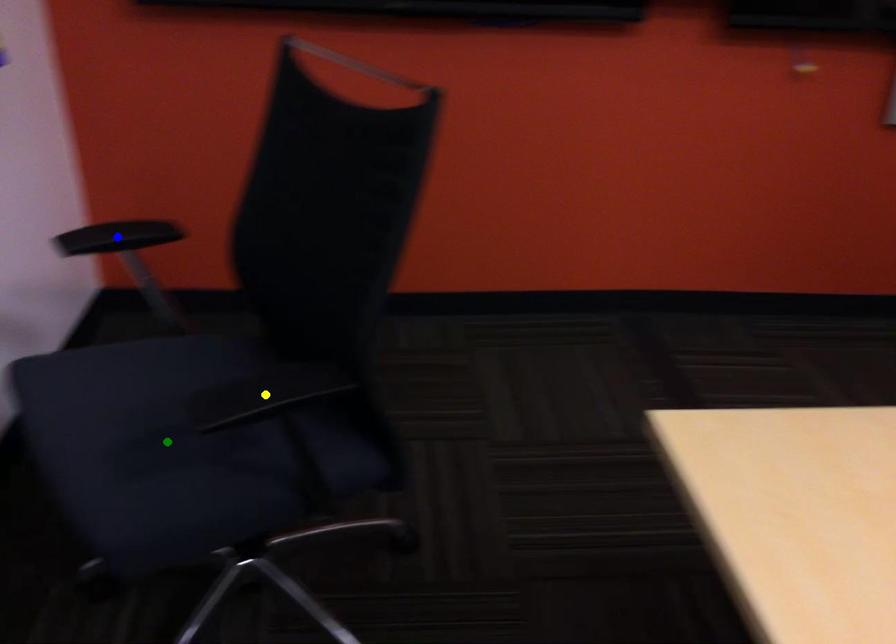
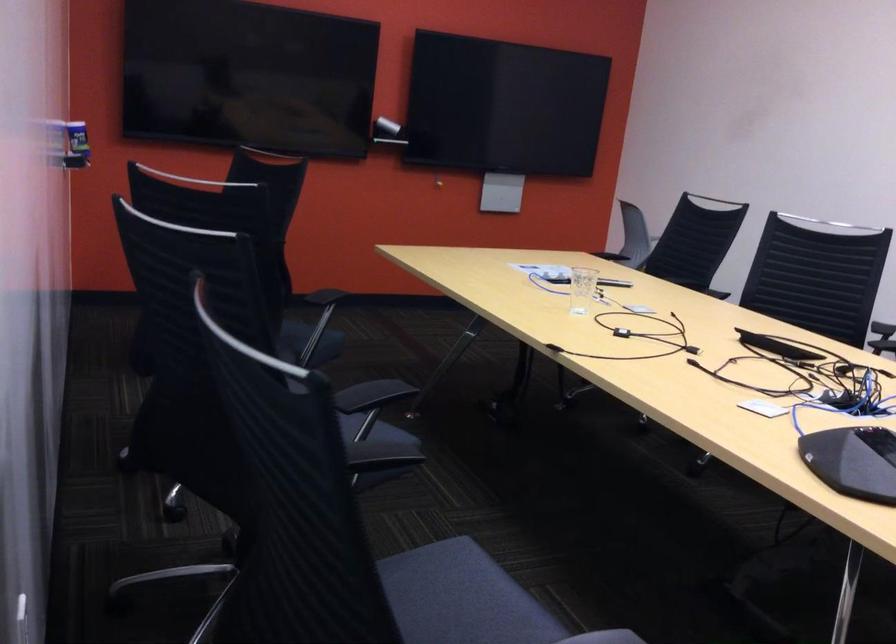
I am providing you with two images of the same scene from different viewpoints. Three points are marked in image1. Which point corresponds to a part or object that is occluded in image2?In image1, three points are marked. Which of them correspond to a part or object that is occluded in image2?Among the three points shown in image1, which one corresponds to a part or object that is no longer visible due to occlusion in image2?

green point, yellow point, blue point